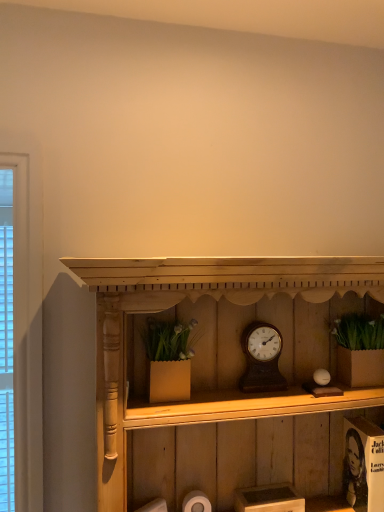
Question: In the image, is wooden shelf at center on the left side or the right side of wooden clock at center?

Choices:
 (A) right
 (B) left

Answer: (B)

Question: Is wooden shelf at center bigger or smaller than wooden clock at center?

Choices:
 (A) big
 (B) small

Answer: (A)

Question: Considering the real-world distances, which object is farthest from the white matte toilet paper at lower center?

Choices:
 (A) wooden clock at center
 (B) wooden shelf at center

Answer: (B)

Question: Which of these objects is positioned closest to the white matte toilet paper at lower center?

Choices:
 (A) wooden shelf at center
 (B) wooden clock at center

Answer: (B)